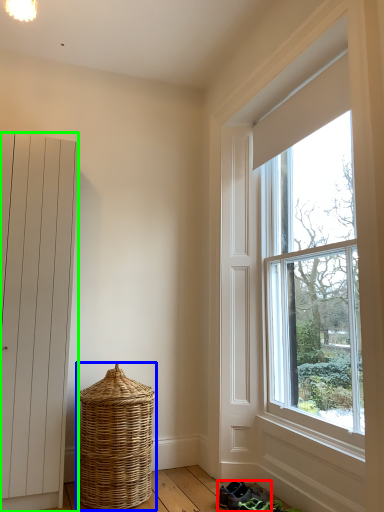
Question: Based on their relative distances, which object is nearer to footwear (highlighted by a red box)? Choose from basket (highlighted by a blue box) and door (highlighted by a green box).

Choices:
 (A) basket
 (B) door

Answer: (A)